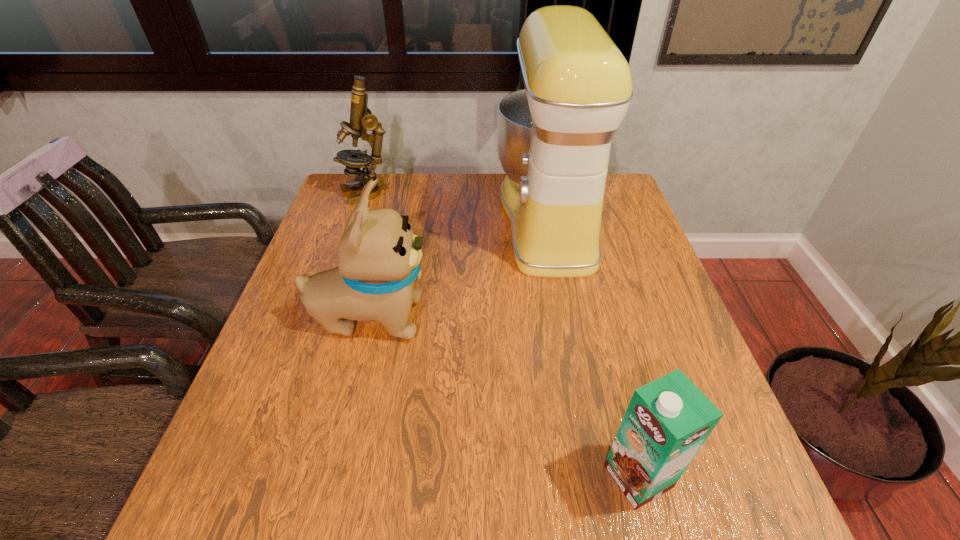
At what (x,y) coordinates should I click in order to perform the action: click on the tallest object. Please return your answer as a coordinate pair (x, y). Looking at the image, I should click on (554, 137).

Image resolution: width=960 pixels, height=540 pixels. What are the coordinates of `microscope` in the screenshot? It's located at (361, 118).

Where is `puppy`? The height and width of the screenshot is (540, 960). puppy is located at coordinates (379, 259).

Find the location of a particular element. The width and height of the screenshot is (960, 540). the shortest object is located at coordinates (668, 420).

Find the location of a particular element. the nearest object is located at coordinates (668, 420).

Locate an element on the screen. vacant area situated 0.290m on the side of the mixer with the control knob is located at coordinates coord(397,219).

What are the coordinates of `blank area located on the side of the mixer with the control knob` in the screenshot? It's located at (459, 219).

At what (x,y) coordinates should I click in order to perform the action: click on free region located 0.140m on the side of the mixer with the control knob. Please return your answer as a coordinate pair (x, y). Image resolution: width=960 pixels, height=540 pixels. Looking at the image, I should click on (448, 219).

The image size is (960, 540). I want to click on free space located 0.290m on the right of the microscope, so click(x=483, y=193).

The height and width of the screenshot is (540, 960). What are the coordinates of `blank space located on the face of the third farthest object` in the screenshot? It's located at (582, 318).